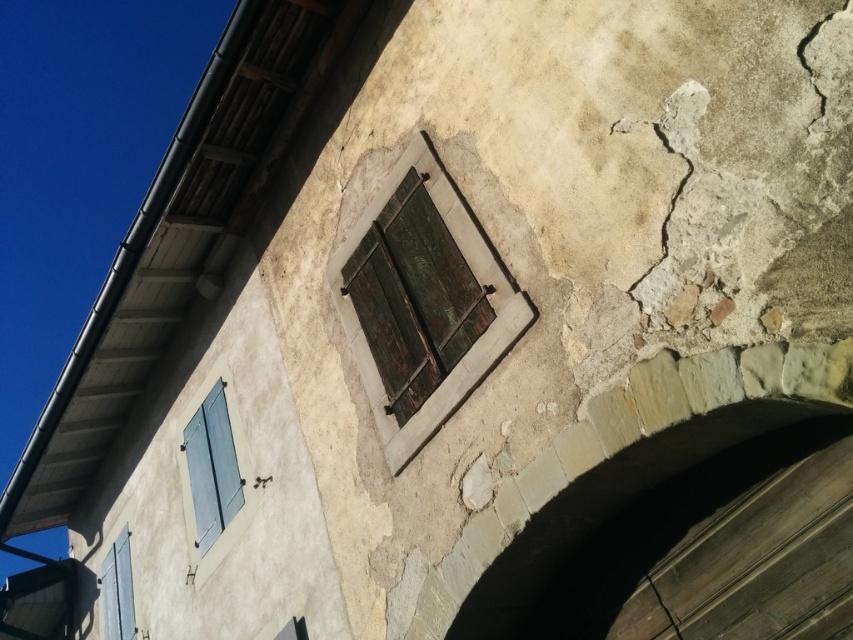
Is the position of rusty wood window at center more distant than that of matte gray shutters at lower left?

That is False.

Which is in front, point (380, 225) or point (109, 630)?

Positioned in front is point (380, 225).

Between point (399, 300) and point (122, 573), which one is positioned in front?

Point (399, 300)

Locate an element on the screen. Image resolution: width=853 pixels, height=640 pixels. rusty wood window at center is located at coordinates (413, 296).

Who is more distant from viewer, (793, 419) or (672, 620)?

The point (672, 620) is behind.

Between stone archway at lower center and dark gray concrete crack at lower center, which one has more height?

stone archway at lower center is taller.

Does point (842, 451) come closer to viewer compared to point (676, 625)?

Yes.

Locate an element on the screen. stone archway at lower center is located at coordinates (686, 532).

Which is below, matte gray shutters at lower left or dark gray concrete crack at lower center?

matte gray shutters at lower left is below.

The width and height of the screenshot is (853, 640). Identify the location of matte gray shutters at lower left. (117, 589).

Where is `matte gray shutters at lower left`? matte gray shutters at lower left is located at coordinates (117, 589).